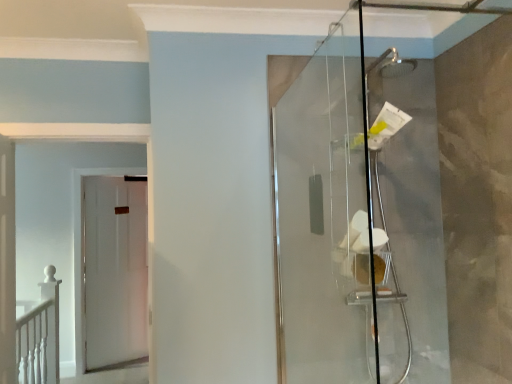
Question: Is white matte railing at lower left completely or partially inside transparent glass shower door at right?

Choices:
 (A) no
 (B) yes

Answer: (A)

Question: Would you consider transparent glass shower door at right to be distant from white matte railing at lower left?

Choices:
 (A) yes
 (B) no

Answer: (A)

Question: Is transparent glass shower door at right looking in the opposite direction of white matte railing at lower left?

Choices:
 (A) yes
 (B) no

Answer: (B)

Question: Considering the relative positions of transparent glass shower door at right and white matte railing at lower left in the image provided, is transparent glass shower door at right behind white matte railing at lower left?

Choices:
 (A) no
 (B) yes

Answer: (A)

Question: Does transparent glass shower door at right have a lesser height compared to white matte railing at lower left?

Choices:
 (A) no
 (B) yes

Answer: (A)

Question: Considering the relative positions of transparent glass shower door at right and white matte railing at lower left in the image provided, is transparent glass shower door at right to the left of white matte railing at lower left from the viewer's perspective?

Choices:
 (A) no
 (B) yes

Answer: (A)

Question: Is white matte door at left, the 2th door from the front, shorter than white matte door at left, the 2th door in the back-to-front sequence?

Choices:
 (A) no
 (B) yes

Answer: (A)

Question: Can you confirm if white matte door at left, the 2th door from the front, is wider than white matte door at left, the 2th door in the back-to-front sequence?

Choices:
 (A) no
 (B) yes

Answer: (A)

Question: From the image's perspective, is white matte door at left, the 2th door from the front, located above white matte door at left, the 2th door in the back-to-front sequence?

Choices:
 (A) yes
 (B) no

Answer: (B)

Question: Is white matte door at left, the 2th door from the front, taller than white matte door at left, the 2th door in the back-to-front sequence?

Choices:
 (A) no
 (B) yes

Answer: (B)

Question: Can you confirm if white matte door at left, which appears as the 1th door when viewed from the back, is positioned to the right of white matte door at left, arranged as the first door when viewed from the front?

Choices:
 (A) no
 (B) yes

Answer: (A)

Question: Is white matte door at left, the 2th door from the front, further to camera compared to white matte door at left, the 2th door in the back-to-front sequence?

Choices:
 (A) yes
 (B) no

Answer: (A)

Question: From the image's perspective, is white matte door at left, arranged as the first door when viewed from the front, on top of transparent glass shower door at right?

Choices:
 (A) yes
 (B) no

Answer: (B)